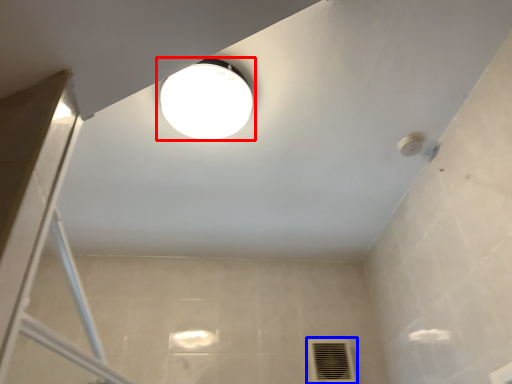
Question: Among these objects, which one is farthest to the camera, lamp (highlighted by a red box) or air conditioning (highlighted by a blue box)?

Choices:
 (A) lamp
 (B) air conditioning

Answer: (B)